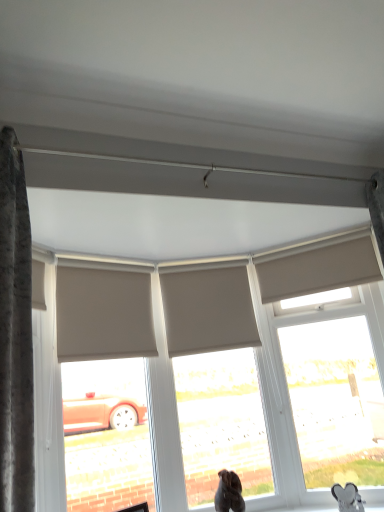
Question: In which direction should I rotate to look at matte gray window at center, which appears as the 2th window when viewed from the right?

Choices:
 (A) left
 (B) right

Answer: (B)

Question: In which direction should I rotate to look at beige fabric shutter at upper center, which is the 1th shutter in right-to-left order?

Choices:
 (A) right
 (B) left

Answer: (A)

Question: From a real-world perspective, is brown fur dog at lower center positioned over matte beige window at upper right, the 2th window in the left-to-right sequence, based on gravity?

Choices:
 (A) no
 (B) yes

Answer: (A)

Question: Can you confirm if brown fur dog at lower center is thinner than matte beige window at upper right, which is the 1th window from right to left?

Choices:
 (A) no
 (B) yes

Answer: (A)

Question: Considering the relative sizes of brown fur dog at lower center and matte beige window at upper right, the 2th window in the left-to-right sequence, in the image provided, is brown fur dog at lower center bigger than matte beige window at upper right, the 2th window in the left-to-right sequence,?

Choices:
 (A) no
 (B) yes

Answer: (A)

Question: Is brown fur dog at lower center oriented towards matte beige window at upper right, the 2th window in the left-to-right sequence?

Choices:
 (A) no
 (B) yes

Answer: (A)

Question: Can you confirm if brown fur dog at lower center is smaller than matte beige window at upper right, the 2th window in the left-to-right sequence?

Choices:
 (A) no
 (B) yes

Answer: (B)

Question: From a real-world perspective, is brown fur dog at lower center positioned under matte beige window at upper right, which is the 1th window from right to left, based on gravity?

Choices:
 (A) yes
 (B) no

Answer: (A)

Question: Could you tell me if beige fabric roller blind at upper left, arranged as the first shutter when viewed from the left, is turned towards beige fabric shutter at center, arranged as the 2th shutter when viewed from the right?

Choices:
 (A) yes
 (B) no

Answer: (B)

Question: Does beige fabric roller blind at upper left, arranged as the first shutter when viewed from the left, lie behind beige fabric shutter at center, arranged as the 2th shutter when viewed from the right?

Choices:
 (A) no
 (B) yes

Answer: (A)

Question: Does beige fabric roller blind at upper left, which is counted as the 3th shutter, starting from the right, have a lesser width compared to beige fabric shutter at center, arranged as the 2th shutter when viewed from the right?

Choices:
 (A) no
 (B) yes

Answer: (A)

Question: From the image's perspective, is beige fabric roller blind at upper left, which is counted as the 3th shutter, starting from the right, on beige fabric shutter at center, arranged as the 2th shutter when viewed from the right?

Choices:
 (A) no
 (B) yes

Answer: (B)

Question: Is beige fabric roller blind at upper left, arranged as the first shutter when viewed from the left, taller than beige fabric shutter at center, arranged as the 2th shutter when viewed from the right?

Choices:
 (A) no
 (B) yes

Answer: (A)

Question: Does beige fabric roller blind at upper left, arranged as the first shutter when viewed from the left, have a greater width compared to beige fabric shutter at center, which is the second shutter from left to right?

Choices:
 (A) no
 (B) yes

Answer: (B)

Question: Considering the relative positions of matte gray window at center, placed as the 1th window when sorted from left to right, and brown fur dog at lower center in the image provided, is matte gray window at center, placed as the 1th window when sorted from left to right, to the right of brown fur dog at lower center from the viewer's perspective?

Choices:
 (A) no
 (B) yes

Answer: (A)